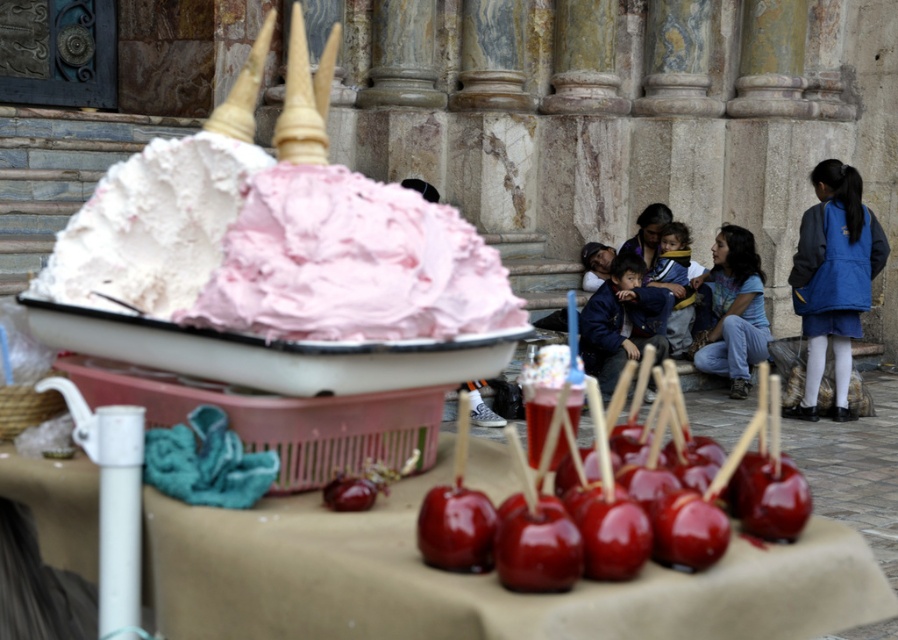
Question: Can you confirm if white fluffy frosting at center is positioned above blue fleece jacket at right?

Choices:
 (A) yes
 (B) no

Answer: (B)

Question: Is pink fluffy frosting at center above blue fleece jacket at right?

Choices:
 (A) no
 (B) yes

Answer: (A)

Question: Which object appears farthest from the camera in this image?

Choices:
 (A) glossy red apple at lower center
 (B) blue denim jeans at lower right

Answer: (B)

Question: Among these points, which one is farthest from the camera?

Choices:
 (A) (425, 321)
 (B) (864, 272)
 (C) (468, 534)

Answer: (B)

Question: Can you confirm if blue denim jeans at lower right is positioned above glossy red apple at lower center?

Choices:
 (A) no
 (B) yes

Answer: (B)

Question: Which object is positioned farthest from the white fluffy frosting at center?

Choices:
 (A) pink fluffy frosting at center
 (B) glossy red apple at lower center

Answer: (B)